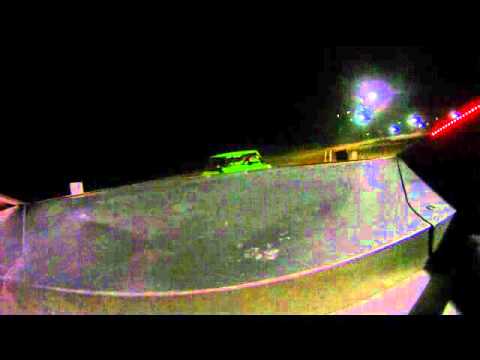
In order to click on trash can in this screenshot , I will do `click(337, 149)`.